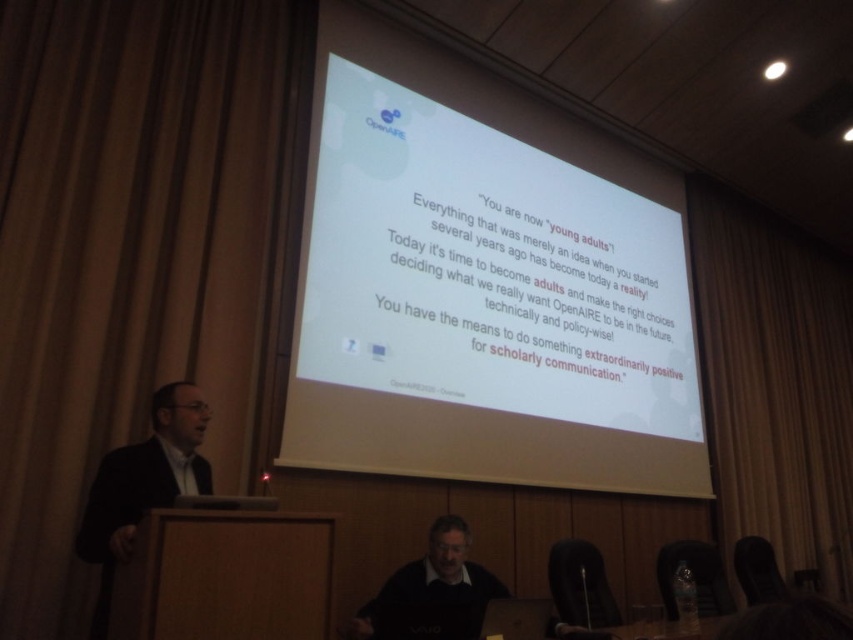
Can you confirm if wooden table at lower left is smaller than black suit at left?

Yes.

Is wooden table at lower left to the left of black suit at left from the viewer's perspective?

In fact, wooden table at lower left is to the right of black suit at left.

The height and width of the screenshot is (640, 853). I want to click on wooden table at lower left, so coord(225,577).

Identify the location of wooden table at lower left. (225, 577).

The image size is (853, 640). Describe the element at coordinates (775, 385) in the screenshot. I see `brown fabric curtain at upper left` at that location.

Is point (849, 346) behind point (405, 564)?

Yes, point (849, 346) is farther from viewer.

Where is `brown fabric curtain at upper left`? The height and width of the screenshot is (640, 853). brown fabric curtain at upper left is located at coordinates (775, 385).

Who is shorter, white matte projector screen at upper center or black suit at left?

With less height is black suit at left.

This screenshot has height=640, width=853. What do you see at coordinates (485, 289) in the screenshot?
I see `white matte projector screen at upper center` at bounding box center [485, 289].

Who is more forward, (619, 179) or (102, 557)?

Point (102, 557)

What are the coordinates of `white matte projector screen at upper center` in the screenshot? It's located at (485, 289).